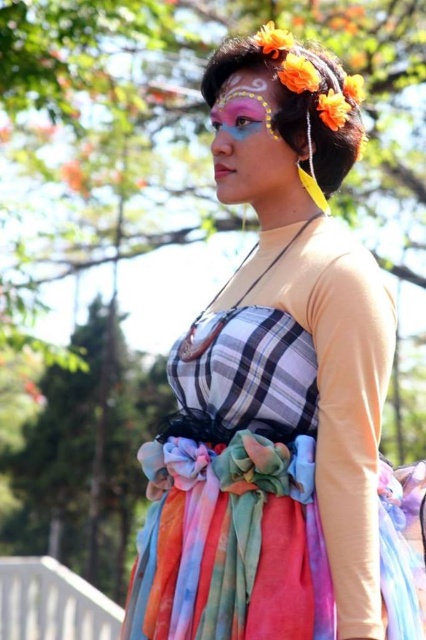
You are taking a photo of the person in the park and want to focus on both the belt and the hem of their skirt. The belt is at point (368, 611) and the hem is at point (230, 195). Which point should you adjust your camera focus to prioritize for a clearer image?

Point (368, 611) is closer to the camera than point (230, 195). To ensure both the belt and the hem are in focus, adjust the camera focus to the closer point, point (368, 611), and use a smaller aperture for a deeper depth of field.

You are a photographer trying to capture the person in the scene. Since the multicolored fabric dress at center and the matte colorful face at center are both important, which one should you focus on to ensure both are visible in the photo?

The multicolored fabric dress at center is larger in size than the matte colorful face at center, so focusing on the dress will ensure both are visible in the photo.

You are a photographer trying to capture the person in the image. Since you want to focus on their face, you need to adjust your camera to ensure the matte colorful face at center is above the multicolored fabric dress at center. Is this possible based on the current positioning?

Yes, the matte colorful face at center is already positioned above the multicolored fabric dress at center, so adjusting the camera to focus on the face while keeping the dress below is possible.